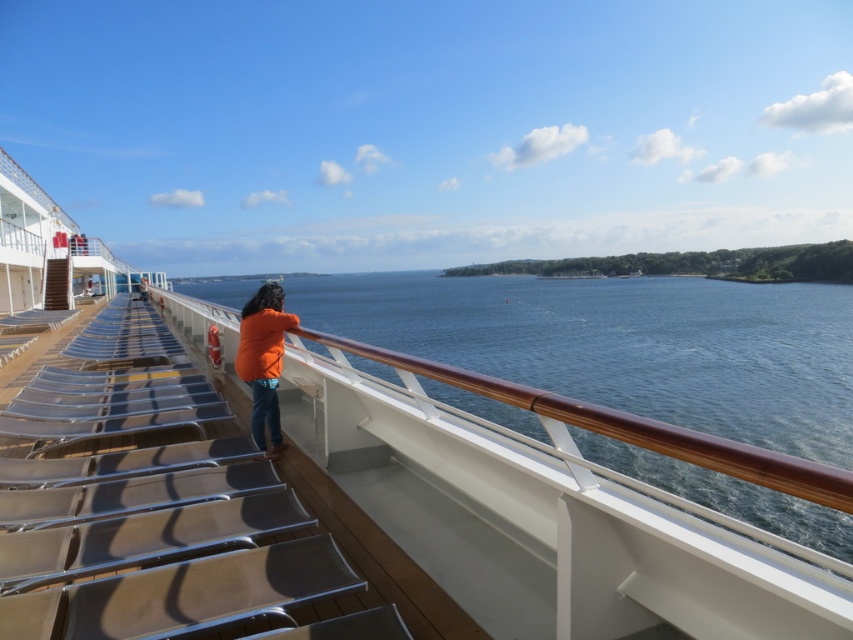
You are standing on the cruise ship deck and want to take a photo of the blue water at center and the orange fabric jacket at center. Which object should you focus on first if you want both to be in the same frame without moving the camera?

The blue water at center is located above the orange fabric jacket at center, so you should focus on the orange fabric jacket at center first to ensure both are in the same frame without moving the camera.

You are a photographer on the cruise ship deck. You want to take a photo that includes both the blue water at center and the orange fabric jacket at center. Which object should you focus on first if you want to capture both in the frame without moving the camera?

The blue water at center is bigger than the orange fabric jacket at center, so you should focus on the orange fabric jacket at center first to ensure it fits within the frame while still capturing the larger blue water at center.

You are a photographer trying to capture the entire view of the blue water at center and orange fabric jacket at center in one shot. Based on their sizes, which object would require you to adjust your camera to a wider angle to ensure both fit in the frame?

The blue water at center has a larger width than the orange fabric jacket at center, so you would need to adjust your camera to a wider angle to capture both in one shot.